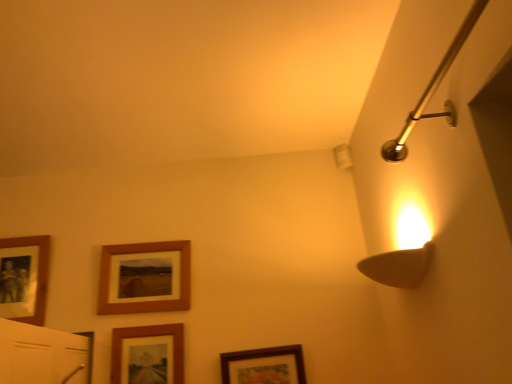
Question: Considering the relative sizes of wooden picture frame at center, the second picture frame in the left-to-right sequence, and wooden framed picture at lower center, arranged as the 2th picture frame when viewed from the right, in the image provided, is wooden picture frame at center, the second picture frame in the left-to-right sequence, bigger than wooden framed picture at lower center, arranged as the 2th picture frame when viewed from the right,?

Choices:
 (A) yes
 (B) no

Answer: (A)

Question: Is wooden framed picture at lower center, arranged as the 3th picture frame when viewed from the left, at the back of wooden picture frame at center, which ranks as the 3th picture frame in right-to-left order?

Choices:
 (A) yes
 (B) no

Answer: (B)

Question: Can you confirm if wooden picture frame at center, the second picture frame in the left-to-right sequence, is shorter than wooden framed picture at lower center, arranged as the 2th picture frame when viewed from the right?

Choices:
 (A) no
 (B) yes

Answer: (B)

Question: Can you confirm if wooden picture frame at center, which ranks as the 3th picture frame in right-to-left order, is smaller than wooden framed picture at lower center, arranged as the 3th picture frame when viewed from the left?

Choices:
 (A) no
 (B) yes

Answer: (A)

Question: From the image's perspective, would you say wooden picture frame at center, which ranks as the 3th picture frame in right-to-left order, is shown under wooden framed picture at lower center, arranged as the 2th picture frame when viewed from the right?

Choices:
 (A) yes
 (B) no

Answer: (B)

Question: From a real-world perspective, is polished brass shower arm at upper right physically located above or below wooden framed picture at lower center, placed as the 4th picture frame when sorted from left to right?

Choices:
 (A) below
 (B) above

Answer: (B)

Question: From the image's perspective, is polished brass shower arm at upper right located above or below wooden framed picture at lower center, placed as the first picture frame when sorted from right to left?

Choices:
 (A) below
 (B) above

Answer: (B)

Question: In terms of size, does polished brass shower arm at upper right appear bigger or smaller than wooden framed picture at lower center, placed as the first picture frame when sorted from right to left?

Choices:
 (A) big
 (B) small

Answer: (A)

Question: Does point (473, 13) appear closer or farther from the camera than point (276, 367)?

Choices:
 (A) farther
 (B) closer

Answer: (B)

Question: In terms of size, does wooden framed picture at lower center, placed as the 4th picture frame when sorted from left to right, appear bigger or smaller than wooden framed picture at lower center, arranged as the 3th picture frame when viewed from the left?

Choices:
 (A) big
 (B) small

Answer: (B)

Question: Considering the positions of wooden framed picture at lower center, placed as the first picture frame when sorted from right to left, and wooden framed picture at lower center, arranged as the 2th picture frame when viewed from the right, in the image, is wooden framed picture at lower center, placed as the first picture frame when sorted from right to left, taller or shorter than wooden framed picture at lower center, arranged as the 2th picture frame when viewed from the right,?

Choices:
 (A) tall
 (B) short

Answer: (B)

Question: Considering the positions of wooden framed picture at lower center, placed as the 4th picture frame when sorted from left to right, and wooden framed picture at lower center, arranged as the 3th picture frame when viewed from the left, in the image, is wooden framed picture at lower center, placed as the 4th picture frame when sorted from left to right, wider or thinner than wooden framed picture at lower center, arranged as the 3th picture frame when viewed from the left,?

Choices:
 (A) wide
 (B) thin

Answer: (A)

Question: Would you say wooden framed picture at lower center, placed as the 4th picture frame when sorted from left to right, is inside or outside wooden framed picture at lower center, arranged as the 3th picture frame when viewed from the left?

Choices:
 (A) outside
 (B) inside

Answer: (A)

Question: Is wooden framed picture at lower center, arranged as the 3th picture frame when viewed from the left, wider or thinner than wooden framed picture at lower center, placed as the first picture frame when sorted from right to left?

Choices:
 (A) wide
 (B) thin

Answer: (B)

Question: Relative to wooden framed picture at lower center, placed as the first picture frame when sorted from right to left, is wooden framed picture at lower center, arranged as the 2th picture frame when viewed from the right, in front or behind?

Choices:
 (A) behind
 (B) front

Answer: (A)